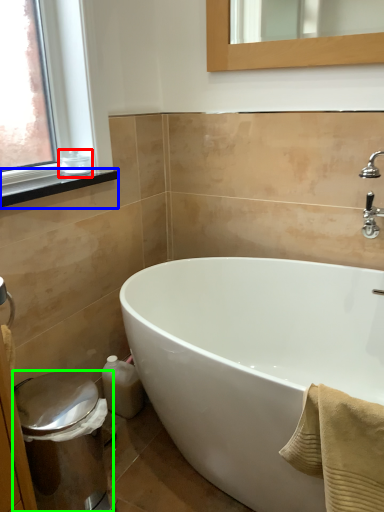
Question: Which object is the closest to the toiletry (highlighted by a red box)? Choose among these: window sill (highlighted by a blue box) or bidet (highlighted by a green box).

Choices:
 (A) window sill
 (B) bidet

Answer: (A)